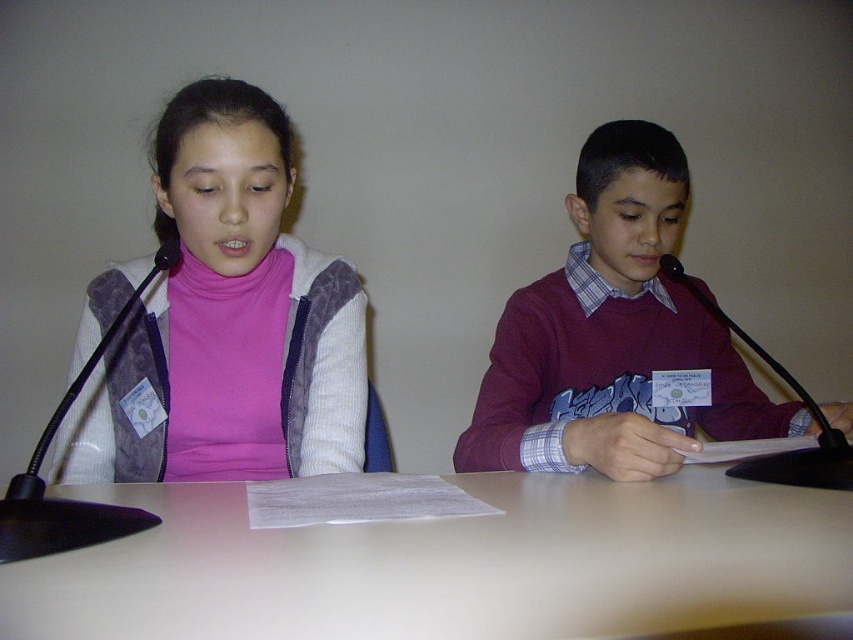
Question: Is white matte table at center to the left of pink fleece sweater at left from the viewer's perspective?

Choices:
 (A) yes
 (B) no

Answer: (B)

Question: Among these objects, which one is nearest to the camera?

Choices:
 (A) pink fleece sweater at left
 (B) maroon sweater at center

Answer: (B)

Question: Does white matte table at center have a larger size compared to maroon sweater at center?

Choices:
 (A) yes
 (B) no

Answer: (B)

Question: Which of the following is the closest to the observer?

Choices:
 (A) (643, 579)
 (B) (196, 436)
 (C) (751, 387)

Answer: (A)

Question: In this image, where is white matte table at center located relative to maroon sweater at center?

Choices:
 (A) below
 (B) above

Answer: (A)

Question: Which point appears farthest from the camera in this image?

Choices:
 (A) (190, 269)
 (B) (561, 477)
 (C) (645, 230)

Answer: (C)